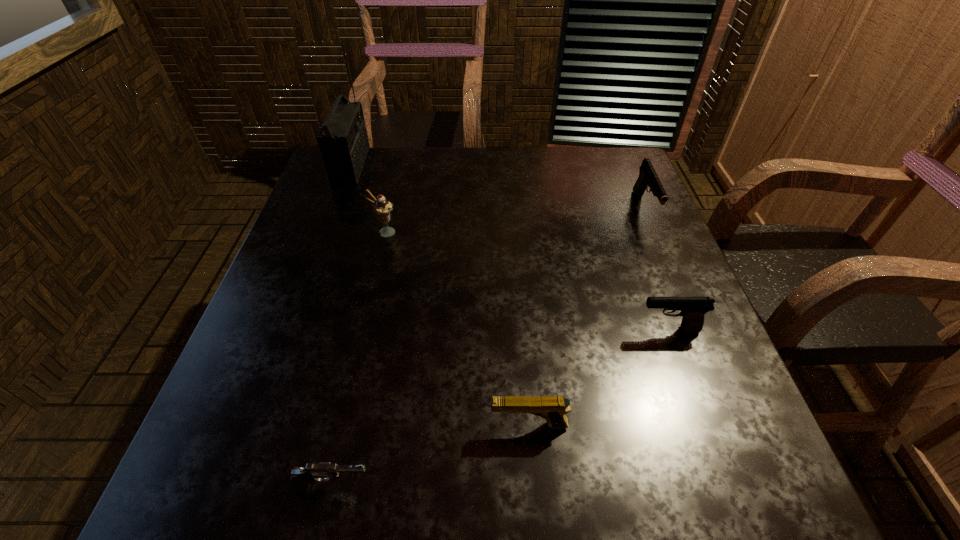
Where is `free region located 0.100m on the left of the icecream`? The width and height of the screenshot is (960, 540). free region located 0.100m on the left of the icecream is located at coordinates (330, 232).

Identify the location of blank space located at the muzzle of the farthest pistol. The image size is (960, 540). (673, 279).

Locate an element on the screen. The image size is (960, 540). free space located 0.160m at the barrel of the second farthest pistol is located at coordinates pos(555,330).

Identify the location of vacant space situated 0.210m at the barrel of the second farthest pistol. This screenshot has height=540, width=960. click(530, 330).

Identify the location of free space located at the barrel of the second farthest pistol. (485, 330).

At what (x,y) coordinates should I click in order to perform the action: click on vacant point located at the barrel of the second nearest object. Please return your answer as a coordinate pair (x, y). Looking at the image, I should click on (454, 425).

Where is `free space located 0.400m at the barrel of the second nearest object`? Image resolution: width=960 pixels, height=540 pixels. free space located 0.400m at the barrel of the second nearest object is located at coordinates (251, 425).

Locate an element on the screen. vacant space located at the barrel of the second nearest object is located at coordinates (299, 425).

This screenshot has height=540, width=960. Find the location of `vacant space located at the barrel of the nearest pistol`. vacant space located at the barrel of the nearest pistol is located at coordinates (412, 486).

Identify the location of radio receiver positioned at the far edge. (343, 141).